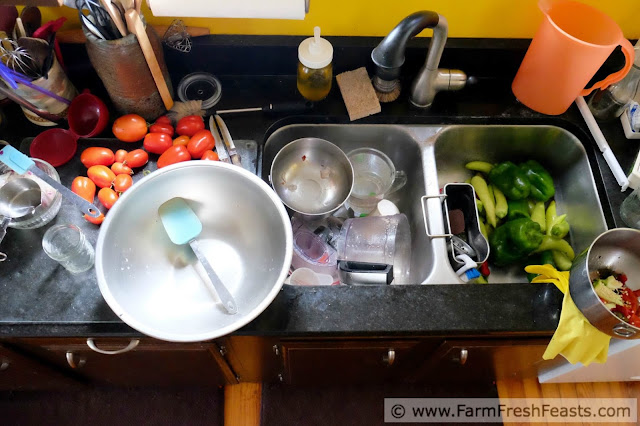
I want to click on sponge, so click(x=355, y=89).